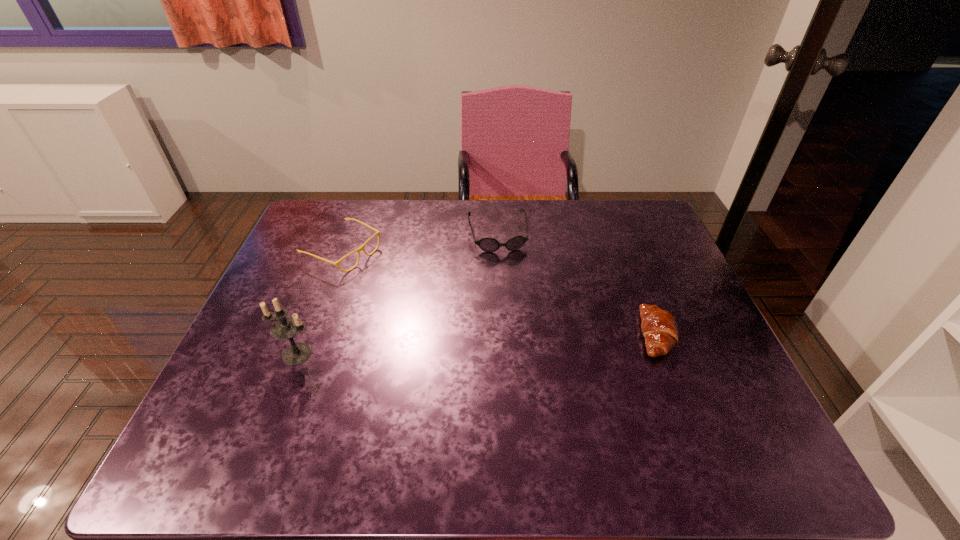
In order to click on candle holder in this screenshot , I will do `click(286, 327)`.

I want to click on crescent roll, so click(659, 328).

Locate an element on the screen. the third object from left to right is located at coordinates (487, 244).

Identify the location of spectacles. (360, 248).

Where is `free spot located on the right of the candle holder`? This screenshot has height=540, width=960. free spot located on the right of the candle holder is located at coordinates (395, 354).

Identify the location of vacant point located 0.140m on the front of the crescent roll. This screenshot has height=540, width=960. (688, 417).

I want to click on vacant space located on the lenses of the third object from left to right, so click(x=509, y=287).

Identify the location of vacant space situated 0.090m on the lenses of the third object from left to right. The height and width of the screenshot is (540, 960). (506, 274).

This screenshot has width=960, height=540. In order to click on free region located 0.210m on the lenses of the third object from left to right in this screenshot , I will do `click(514, 305)`.

Where is `vacant space situated in front of the lenses of the spectacles`? This screenshot has width=960, height=540. vacant space situated in front of the lenses of the spectacles is located at coordinates (451, 303).